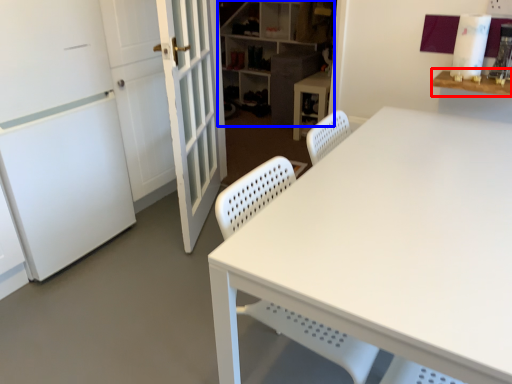
Question: Which point is further to the camera, table (highlighted by a red box) or shelf (highlighted by a blue box)?

Choices:
 (A) table
 (B) shelf

Answer: (B)